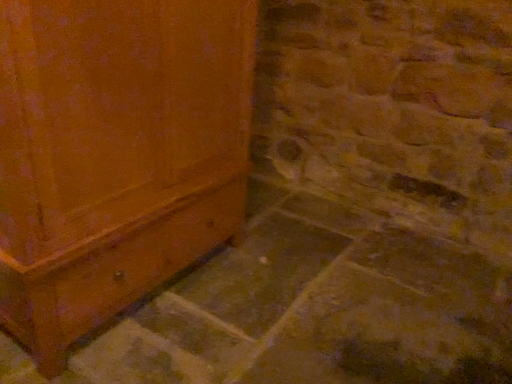
Question: In terms of width, does smooth gray concrete at lower left look wider or thinner when compared to matte wood cabinet at left?

Choices:
 (A) thin
 (B) wide

Answer: (B)

Question: From a real-world perspective, relative to matte wood cabinet at left, is smooth gray concrete at lower left vertically above or below?

Choices:
 (A) above
 (B) below

Answer: (B)

Question: Would you say smooth gray concrete at lower left is to the left or to the right of matte wood cabinet at left in the picture?

Choices:
 (A) right
 (B) left

Answer: (A)

Question: Looking at their shapes, would you say matte wood cabinet at left is wider or thinner than smooth gray concrete at lower left?

Choices:
 (A) wide
 (B) thin

Answer: (B)

Question: From the image's perspective, relative to smooth gray concrete at lower left, is matte wood cabinet at left above or below?

Choices:
 (A) below
 (B) above

Answer: (B)

Question: Is matte wood cabinet at left inside or outside of smooth gray concrete at lower left?

Choices:
 (A) outside
 (B) inside

Answer: (A)

Question: Is point (12, 316) closer or farther from the camera than point (207, 281)?

Choices:
 (A) farther
 (B) closer

Answer: (B)